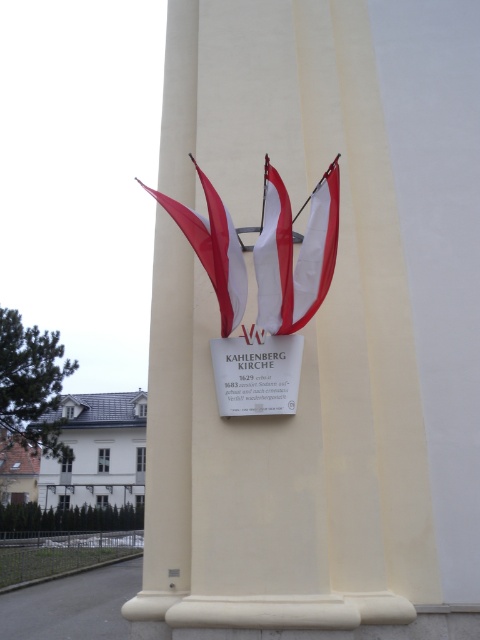
Can you confirm if white smooth pillar at center is positioned below red fabric flag at center?

Yes, white smooth pillar at center is below red fabric flag at center.

Does white smooth pillar at center have a lesser height compared to red fabric flag at center?

Correct, white smooth pillar at center is not as tall as red fabric flag at center.

Locate an element on the screen. This screenshot has height=640, width=480. white smooth pillar at center is located at coordinates (302, 353).

The image size is (480, 640). Find the location of `white smooth pillar at center`. white smooth pillar at center is located at coordinates (302, 353).

Does white matte plaque at center have a greater height compared to white/red striped flag at center?

No.

Who is more forward, (273, 404) or (273, 326)?

Point (273, 404) is more forward.

At what (x,y) coordinates should I click in order to perform the action: click on white matte plaque at center. Please return your answer as a coordinate pair (x, y). The width and height of the screenshot is (480, 640). Looking at the image, I should click on (256, 372).

Who is taller, red fabric flag at center or white matte flag at center?

With more height is red fabric flag at center.

Which of these two, red fabric flag at center or white matte flag at center, stands shorter?

white matte flag at center is shorter.

At what (x,y) coordinates should I click in order to perform the action: click on red fabric flag at center. Please return your answer as a coordinate pair (x, y). Looking at the image, I should click on (213, 248).